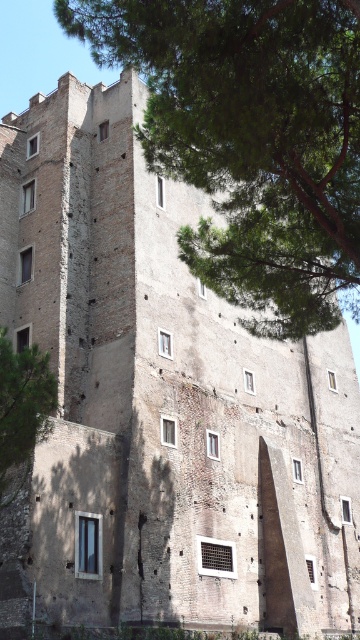
Is green leafy tree at upper center shorter than green leafy tree at left?

Incorrect, green leafy tree at upper center's height does not fall short of green leafy tree at left's.

Find the location of a particular element. green leafy tree at upper center is located at coordinates (250, 138).